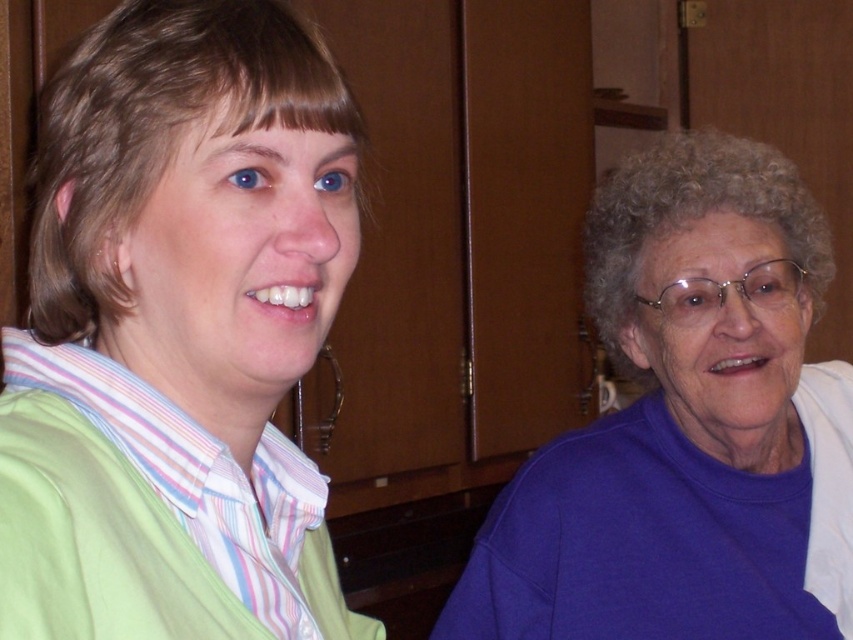
Is point (177, 294) closer to camera compared to point (729, 179)?

Yes, it is.

You are a GUI agent. You are given a task and a screenshot of the screen. Output one action in this format:
    pyautogui.click(x=<x>, y=<y>)
    Task: Click on the purple matte sweater at center
    The image size is (853, 640).
    Given the screenshot: What is the action you would take?
    pyautogui.click(x=178, y=332)

Locate an element on the screen. The width and height of the screenshot is (853, 640). purple matte sweater at center is located at coordinates (178, 332).